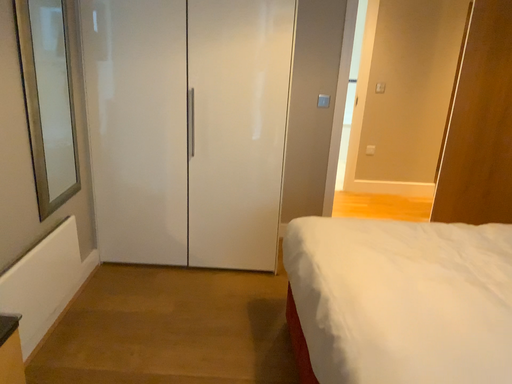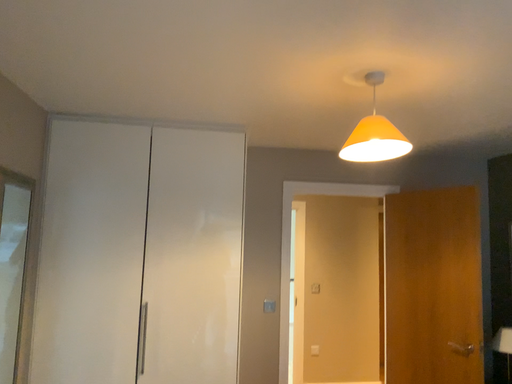
Question: Which way did the camera rotate in the video?

Choices:
 (A) rotated right
 (B) rotated left

Answer: (A)